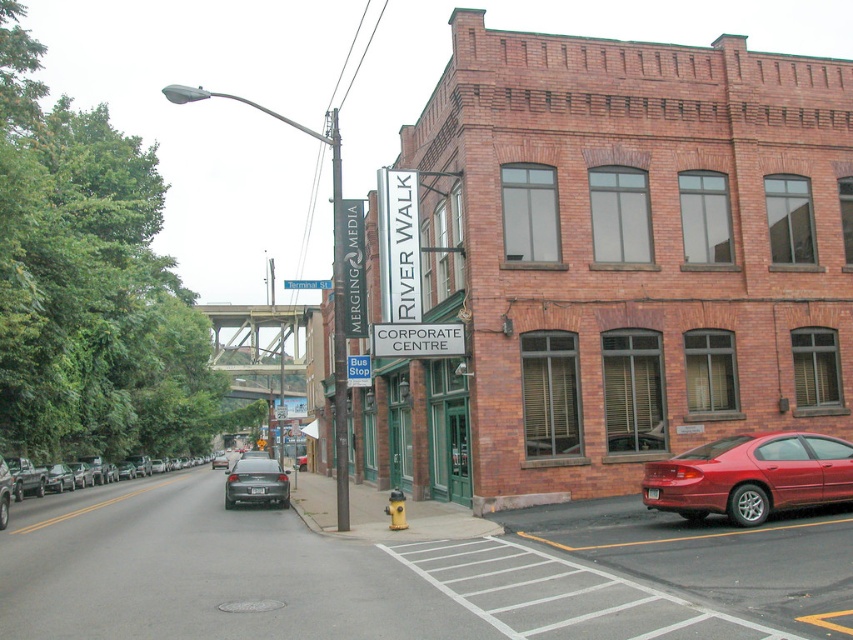
In the scene shown: Is metallic gray signpost at center wider than matte black sedan at left?

Correct, the width of metallic gray signpost at center exceeds that of matte black sedan at left.

Is metallic gray signpost at center to the left of matte black sedan at left from the viewer's perspective?

In fact, metallic gray signpost at center is to the right of matte black sedan at left.

Which is in front, point (335, 362) or point (57, 476)?

Positioned in front is point (335, 362).

You are a GUI agent. You are given a task and a screenshot of the screen. Output one action in this format:
    pyautogui.click(x=<x>, y=<y>)
    Task: Click on the metallic gray signpost at center
    The image size is (853, 640).
    Given the screenshot: What is the action you would take?
    pyautogui.click(x=339, y=333)

Does point (276, 465) lie behind point (51, 481)?

No, it is not.

Does point (247, 470) come in front of point (62, 465)?

Yes.

The image size is (853, 640). Describe the element at coordinates (256, 483) in the screenshot. I see `matte black sedan at center` at that location.

Locate an element on the screen. The image size is (853, 640). matte black sedan at center is located at coordinates point(256,483).

Looking at this image, between shiny red sedan at lower right and blue metallic street sign at upper center, which one has less height?

Standing shorter between the two is shiny red sedan at lower right.

Between shiny red sedan at lower right and blue metallic street sign at upper center, which one is positioned lower?

shiny red sedan at lower right is lower down.

Between point (721, 486) and point (289, 285), which one is positioned behind?

The point (289, 285) is behind.

Find the location of a particular element. The image size is (853, 640). shiny red sedan at lower right is located at coordinates (750, 476).